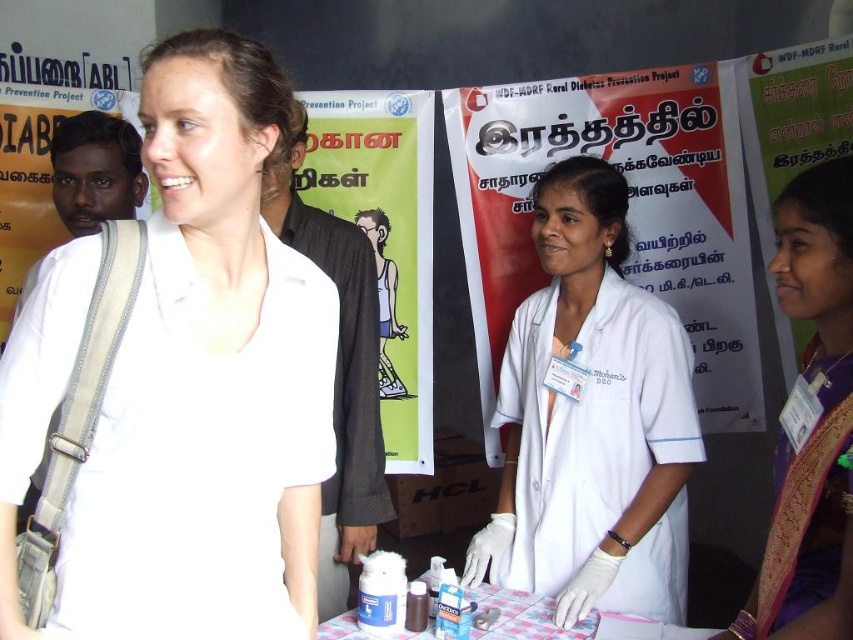
Can you confirm if white matte shirt at upper left is positioned above purple silk saree at right?

Yes, white matte shirt at upper left is above purple silk saree at right.

Which of these two, white matte shirt at upper left or purple silk saree at right, stands taller?

white matte shirt at upper left is taller.

The width and height of the screenshot is (853, 640). What do you see at coordinates (186, 385) in the screenshot? I see `white matte shirt at upper left` at bounding box center [186, 385].

Locate an element on the screen. white matte shirt at upper left is located at coordinates (186, 385).

Describe the element at coordinates (590, 419) in the screenshot. I see `white lab coat at center` at that location.

Who is more distant from viewer, (526, 552) or (393, 566)?

The point (526, 552) is more distant.

This screenshot has width=853, height=640. What are the coordinates of `white lab coat at center` in the screenshot? It's located at (590, 419).

What do you see at coordinates (561, 628) in the screenshot? I see `plastic/transparent container at center` at bounding box center [561, 628].

Does plastic/transparent container at center appear on the right side of white plastic bottle at center?

Indeed, plastic/transparent container at center is positioned on the right side of white plastic bottle at center.

Does point (517, 612) lie in front of point (387, 561)?

No, (517, 612) is behind (387, 561).

Find the location of a particular element. plastic/transparent container at center is located at coordinates (561, 628).